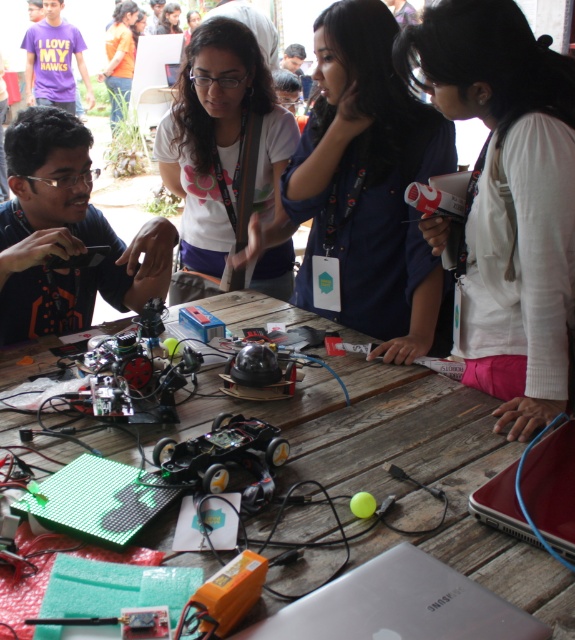
Question: Is wooden table at center to the left of purple cotton shirt at upper left from the viewer's perspective?

Choices:
 (A) yes
 (B) no

Answer: (B)

Question: Is blue fabric shirt at upper center smaller than matte white shirt at center?

Choices:
 (A) no
 (B) yes

Answer: (A)

Question: Does silver metallic laptop at center appear on the left side of red matte laptop at lower right?

Choices:
 (A) yes
 (B) no

Answer: (A)

Question: Which of the following is the closest to the observer?

Choices:
 (A) purple cotton shirt at upper left
 (B) wooden table at center
 (C) matte black shirt at left
 (D) blue fabric shirt at upper center

Answer: (B)

Question: Which point is closer to the camera taking this photo?

Choices:
 (A) (40, 93)
 (B) (515, 144)
 (C) (501, 472)
 (D) (62, 109)

Answer: (C)

Question: Which point is farther to the camera?

Choices:
 (A) pyautogui.click(x=193, y=81)
 (B) pyautogui.click(x=516, y=84)
 (C) pyautogui.click(x=264, y=637)
 (D) pyautogui.click(x=447, y=349)

Answer: (A)